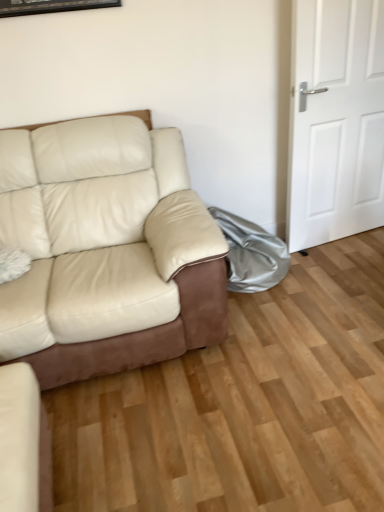
This screenshot has height=512, width=384. Find the location of `silver metallic bag at lower right`. silver metallic bag at lower right is located at coordinates (251, 254).

What do you see at coordinates (251, 254) in the screenshot? I see `silver metallic bag at lower right` at bounding box center [251, 254].

What do you see at coordinates (106, 250) in the screenshot?
I see `beige leather couch at left, marked as the first studio couch in a top-to-bottom arrangement` at bounding box center [106, 250].

This screenshot has height=512, width=384. Describe the element at coordinates (335, 121) in the screenshot. I see `white matte door at right` at that location.

Identify the location of silver metallic bag at lower right. The width and height of the screenshot is (384, 512). click(x=251, y=254).

Where is `door on the right of leather couch at lower left, positioned as the second studio couch in top-to-bottom order`? This screenshot has height=512, width=384. door on the right of leather couch at lower left, positioned as the second studio couch in top-to-bottom order is located at coordinates (335, 121).

From a real-world perspective, does white matte door at right stand above leather couch at lower left, positioned as the first studio couch in bottom-to-top order?

Yes, from a real-world perspective, white matte door at right is above leather couch at lower left, positioned as the first studio couch in bottom-to-top order.

Is white matte door at right inside or outside of leather couch at lower left, positioned as the second studio couch in top-to-bottom order?

white matte door at right is outside leather couch at lower left, positioned as the second studio couch in top-to-bottom order.

Is white matte door at right touching leather couch at lower left, positioned as the second studio couch in top-to-bottom order?

white matte door at right and leather couch at lower left, positioned as the second studio couch in top-to-bottom order, are not in contact.

From a real-world perspective, which object stands above the other?

white matte door at right.

In the image, is white matte door at right on the left side or the right side of silver metallic bag at lower right?

In the image, white matte door at right appears on the right side of silver metallic bag at lower right.

From the image's perspective, which one is positioned lower, white matte door at right or silver metallic bag at lower right?

silver metallic bag at lower right is shown below in the image.

Can you confirm if white matte door at right is bigger than silver metallic bag at lower right?

Yes.

Is beige leather couch at left, marked as the 2th studio couch in a bottom-to-top arrangement, surrounded by leather couch at lower left, positioned as the second studio couch in top-to-bottom order?

Definitely not — beige leather couch at left, marked as the 2th studio couch in a bottom-to-top arrangement, is not inside leather couch at lower left, positioned as the second studio couch in top-to-bottom order.

Looking at the image, does leather couch at lower left, positioned as the second studio couch in top-to-bottom order, seem bigger or smaller compared to beige leather couch at left, marked as the first studio couch in a top-to-bottom arrangement?

leather couch at lower left, positioned as the second studio couch in top-to-bottom order, is smaller than beige leather couch at left, marked as the first studio couch in a top-to-bottom arrangement.

Which is more to the right, leather couch at lower left, positioned as the second studio couch in top-to-bottom order, or beige leather couch at left, marked as the first studio couch in a top-to-bottom arrangement?

beige leather couch at left, marked as the first studio couch in a top-to-bottom arrangement, is more to the right.

Does leather couch at lower left, positioned as the second studio couch in top-to-bottom order, have a lesser width compared to beige leather couch at left, marked as the first studio couch in a top-to-bottom arrangement?

Correct, the width of leather couch at lower left, positioned as the second studio couch in top-to-bottom order, is less than that of beige leather couch at left, marked as the first studio couch in a top-to-bottom arrangement.

Does beige leather couch at left, marked as the first studio couch in a top-to-bottom arrangement, have a lesser height compared to leather couch at lower left, positioned as the first studio couch in bottom-to-top order?

No.

Based on the photo, does beige leather couch at left, marked as the 2th studio couch in a bottom-to-top arrangement, turn towards leather couch at lower left, positioned as the second studio couch in top-to-bottom order?

Yes, beige leather couch at left, marked as the 2th studio couch in a bottom-to-top arrangement, faces towards leather couch at lower left, positioned as the second studio couch in top-to-bottom order.

Is beige leather couch at left, marked as the 2th studio couch in a bottom-to-top arrangement, to the left or to the right of leather couch at lower left, positioned as the first studio couch in bottom-to-top order, in the image?

From the image, it's evident that beige leather couch at left, marked as the 2th studio couch in a bottom-to-top arrangement, is to the right of leather couch at lower left, positioned as the first studio couch in bottom-to-top order.

From the image's perspective, which is above, beige leather couch at left, marked as the first studio couch in a top-to-bottom arrangement, or leather couch at lower left, positioned as the first studio couch in bottom-to-top order?

From the image's view, beige leather couch at left, marked as the first studio couch in a top-to-bottom arrangement, is above.

Considering the sizes of objects white matte door at right and beige leather couch at left, marked as the 2th studio couch in a bottom-to-top arrangement, in the image provided, who is taller, white matte door at right or beige leather couch at left, marked as the 2th studio couch in a bottom-to-top arrangement,?

Standing taller between the two is white matte door at right.

Considering the points (301, 135) and (83, 214), which point is behind, point (301, 135) or point (83, 214)?

Positioned behind is point (301, 135).

Looking at this image, is white matte door at right oriented away from beige leather couch at left, marked as the 2th studio couch in a bottom-to-top arrangement?

white matte door at right does not have its back to beige leather couch at left, marked as the 2th studio couch in a bottom-to-top arrangement.

The image size is (384, 512). I want to click on the 1st studio couch to the left when counting from the white matte door at right, so click(x=106, y=250).

Is leather couch at lower left, positioned as the second studio couch in top-to-bottom order, next to silver metallic bag at lower right and touching it?

No, leather couch at lower left, positioned as the second studio couch in top-to-bottom order, is not touching silver metallic bag at lower right.

Is leather couch at lower left, positioned as the first studio couch in bottom-to-top order, taller or shorter than silver metallic bag at lower right?

leather couch at lower left, positioned as the first studio couch in bottom-to-top order, is shorter than silver metallic bag at lower right.

From a real-world perspective, which object rests below the other?

leather couch at lower left, positioned as the first studio couch in bottom-to-top order, is physically lower.

In the scene shown: Considering the relative sizes of beige leather couch at left, marked as the first studio couch in a top-to-bottom arrangement, and silver metallic bag at lower right in the image provided, is beige leather couch at left, marked as the first studio couch in a top-to-bottom arrangement, smaller than silver metallic bag at lower right?

Incorrect, beige leather couch at left, marked as the first studio couch in a top-to-bottom arrangement, is not smaller in size than silver metallic bag at lower right.

From a real-world perspective, between beige leather couch at left, marked as the first studio couch in a top-to-bottom arrangement, and silver metallic bag at lower right, who is vertically lower?

silver metallic bag at lower right, from a real-world perspective.

Is silver metallic bag at lower right at the back of beige leather couch at left, marked as the 2th studio couch in a bottom-to-top arrangement?

No, beige leather couch at left, marked as the 2th studio couch in a bottom-to-top arrangement,'s orientation is not away from silver metallic bag at lower right.

Is the surface of beige leather couch at left, marked as the first studio couch in a top-to-bottom arrangement, in direct contact with silver metallic bag at lower right?

No, beige leather couch at left, marked as the first studio couch in a top-to-bottom arrangement, is not next to silver metallic bag at lower right.

I want to click on door lying behind the leather couch at lower left, positioned as the second studio couch in top-to-bottom order, so click(335, 121).

This screenshot has height=512, width=384. Find the location of `material that appears below the white matte door at right (from the image's perspective)`. material that appears below the white matte door at right (from the image's perspective) is located at coordinates (251, 254).

From the image, which object appears to be farther from beige leather couch at left, marked as the 2th studio couch in a bottom-to-top arrangement, leather couch at lower left, positioned as the first studio couch in bottom-to-top order, or silver metallic bag at lower right?

leather couch at lower left, positioned as the first studio couch in bottom-to-top order, is positioned further to the anchor beige leather couch at left, marked as the 2th studio couch in a bottom-to-top arrangement.

Estimate the real-world distances between objects in this image. Which object is further from leather couch at lower left, positioned as the second studio couch in top-to-bottom order, silver metallic bag at lower right or beige leather couch at left, marked as the 2th studio couch in a bottom-to-top arrangement?

silver metallic bag at lower right.

From the image, which object appears to be nearer to silver metallic bag at lower right, leather couch at lower left, positioned as the first studio couch in bottom-to-top order, or beige leather couch at left, marked as the first studio couch in a top-to-bottom arrangement?

beige leather couch at left, marked as the first studio couch in a top-to-bottom arrangement.

From the image, which object appears to be nearer to beige leather couch at left, marked as the 2th studio couch in a bottom-to-top arrangement, white matte door at right or leather couch at lower left, positioned as the second studio couch in top-to-bottom order?

The object closer to beige leather couch at left, marked as the 2th studio couch in a bottom-to-top arrangement, is leather couch at lower left, positioned as the second studio couch in top-to-bottom order.

Looking at the image, which one is located closer to silver metallic bag at lower right, white matte door at right or beige leather couch at left, marked as the 2th studio couch in a bottom-to-top arrangement?

white matte door at right.

Looking at the image, which one is located closer to leather couch at lower left, positioned as the second studio couch in top-to-bottom order, silver metallic bag at lower right or white matte door at right?

The object closer to leather couch at lower left, positioned as the second studio couch in top-to-bottom order, is silver metallic bag at lower right.

Estimate the real-world distances between objects in this image. Which object is further from white matte door at right, leather couch at lower left, positioned as the second studio couch in top-to-bottom order, or beige leather couch at left, marked as the 2th studio couch in a bottom-to-top arrangement?

leather couch at lower left, positioned as the second studio couch in top-to-bottom order, is further to white matte door at right.

Based on the photo, based on their spatial positions, is leather couch at lower left, positioned as the second studio couch in top-to-bottom order, or silver metallic bag at lower right further from white matte door at right?

Based on the image, leather couch at lower left, positioned as the second studio couch in top-to-bottom order, appears to be further to white matte door at right.

The image size is (384, 512). Find the location of `material between leather couch at lower left, positioned as the second studio couch in top-to-bottom order, and white matte door at right from left to right`. material between leather couch at lower left, positioned as the second studio couch in top-to-bottom order, and white matte door at right from left to right is located at coordinates (251, 254).

At what (x,y) coordinates should I click in order to perform the action: click on studio couch between leather couch at lower left, positioned as the second studio couch in top-to-bottom order, and white matte door at right, in the horizontal direction. Please return your answer as a coordinate pair (x, y). Looking at the image, I should click on (106, 250).

Locate an element on the screen. Image resolution: width=384 pixels, height=512 pixels. studio couch between leather couch at lower left, positioned as the first studio couch in bottom-to-top order, and silver metallic bag at lower right from front to back is located at coordinates (106, 250).

The width and height of the screenshot is (384, 512). Find the location of `material between beige leather couch at left, marked as the 2th studio couch in a bottom-to-top arrangement, and white matte door at right from left to right`. material between beige leather couch at left, marked as the 2th studio couch in a bottom-to-top arrangement, and white matte door at right from left to right is located at coordinates (251, 254).